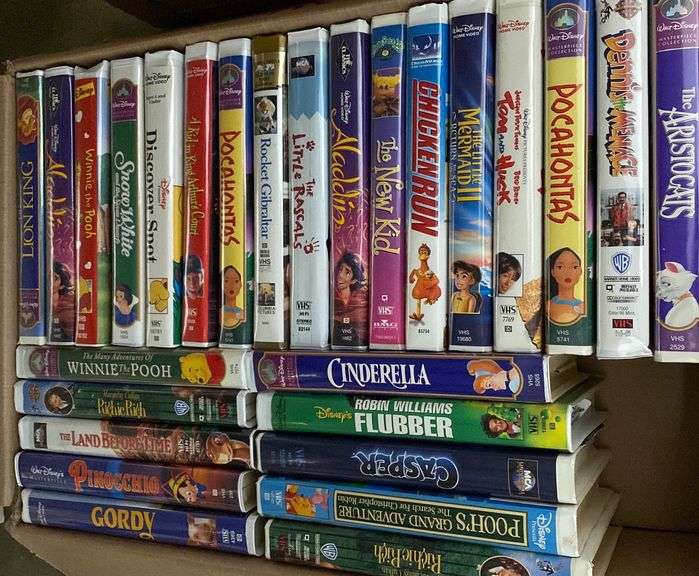
Locate an element on the screen. vhs tapes in right stack is located at coordinates (333, 551), (382, 513), (403, 468), (426, 420), (417, 382).